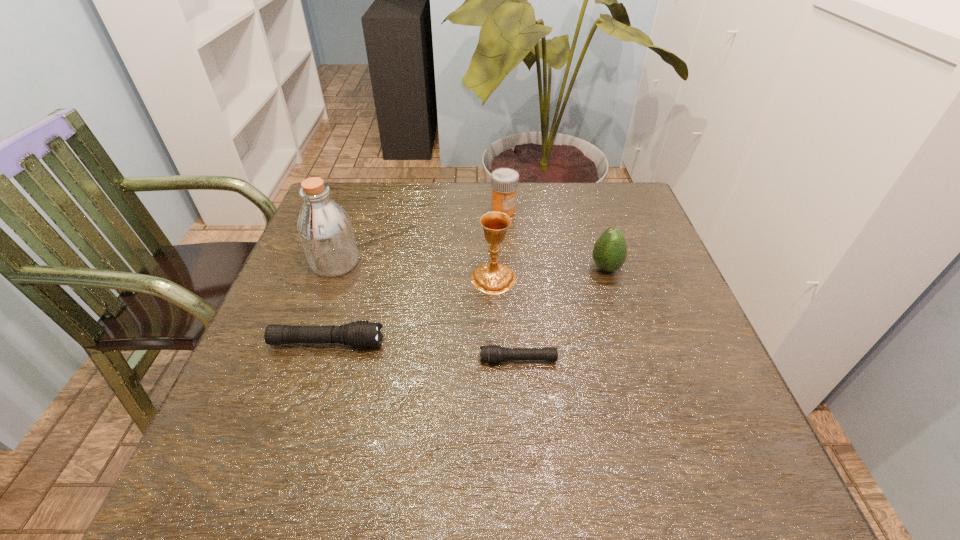
Image resolution: width=960 pixels, height=540 pixels. What are the coordinates of `free point between the tallest object and the farthest object` in the screenshot? It's located at (420, 237).

Locate an element on the screen. This screenshot has width=960, height=540. vacant space that is in between the medicine and the tallest object is located at coordinates (420, 237).

The width and height of the screenshot is (960, 540). Identify the location of vacant space that's between the rightmost object and the bottle. (470, 265).

Find the location of `vacant region between the tallest object and the second shortest object`. vacant region between the tallest object and the second shortest object is located at coordinates (331, 303).

Where is `free spot between the fifth tallest object and the tallest object`? free spot between the fifth tallest object and the tallest object is located at coordinates (331, 303).

Locate an element on the screen. the fifth closest object to the left flashlight is located at coordinates (609, 253).

At what (x,y) coordinates should I click in order to perform the action: click on the third closest object relative to the second shortest object. Please return your answer as a coordinate pair (x, y). Looking at the image, I should click on (493, 278).

The image size is (960, 540). Identify the location of free spot that satisfies the following two spatial constraints: 1. on the label side of the rightmost object; 2. on the left side of the farthest object. (508, 268).

This screenshot has height=540, width=960. I want to click on blank space that satisfies the following two spatial constraints: 1. on the front side of the avocado; 2. at the lens end of the left flashlight, so click(629, 343).

This screenshot has width=960, height=540. In order to click on free location that satisfies the following two spatial constraints: 1. on the label side of the medicine; 2. on the right side of the rightmost object in this screenshot , I will do `click(508, 268)`.